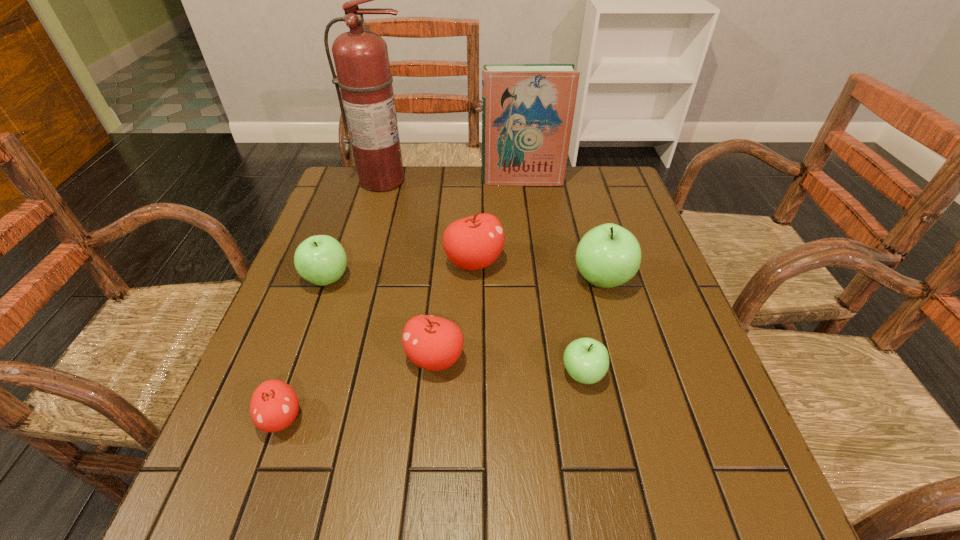
In order to click on free space that satisfies the following two spatial constraints: 1. on the back side of the nearest red apple; 2. on the left side of the smallest green apple in this screenshot , I will do coord(297,374).

In order to click on vacant point that satisfies the following two spatial constraints: 1. on the front side of the leftmost green apple; 2. on the right side of the leftmost red apple in this screenshot , I will do `click(276, 418)`.